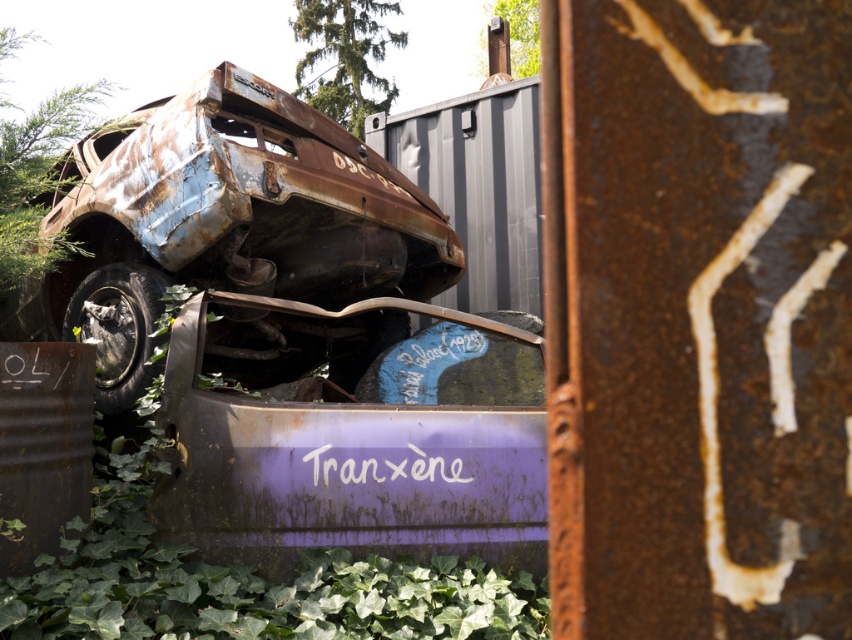
Can you confirm if rusty metal tire at lower left is positioned below green leafy vegetation at upper center?

Indeed, rusty metal tire at lower left is positioned under green leafy vegetation at upper center.

Which is above, rusty metal tire at lower left or green leafy vegetation at upper center?

green leafy vegetation at upper center is above.

Measure the distance between rusty metal tire at lower left and camera.

rusty metal tire at lower left and camera are 12.37 feet apart from each other.

Identify the location of rusty metal tire at lower left. The height and width of the screenshot is (640, 852). (118, 330).

Measure the distance between rusty metal car at center and rusty metal tire at lower left.

They are 21.57 inches apart.

Can you confirm if rusty metal car at center is positioned to the right of rusty metal tire at lower left?

Yes, rusty metal car at center is to the right of rusty metal tire at lower left.

What do you see at coordinates (223, 224) in the screenshot? Image resolution: width=852 pixels, height=640 pixels. I see `rusty metal car at center` at bounding box center [223, 224].

Identify the location of rusty metal car at center. The image size is (852, 640). (223, 224).

Can you confirm if rusty metal car at center is taller than purple matte car at center?

Indeed, rusty metal car at center has a greater height compared to purple matte car at center.

Can you confirm if rusty metal car at center is positioned to the right of purple matte car at center?

Incorrect, rusty metal car at center is not on the right side of purple matte car at center.

Image resolution: width=852 pixels, height=640 pixels. I want to click on rusty metal car at center, so click(223, 224).